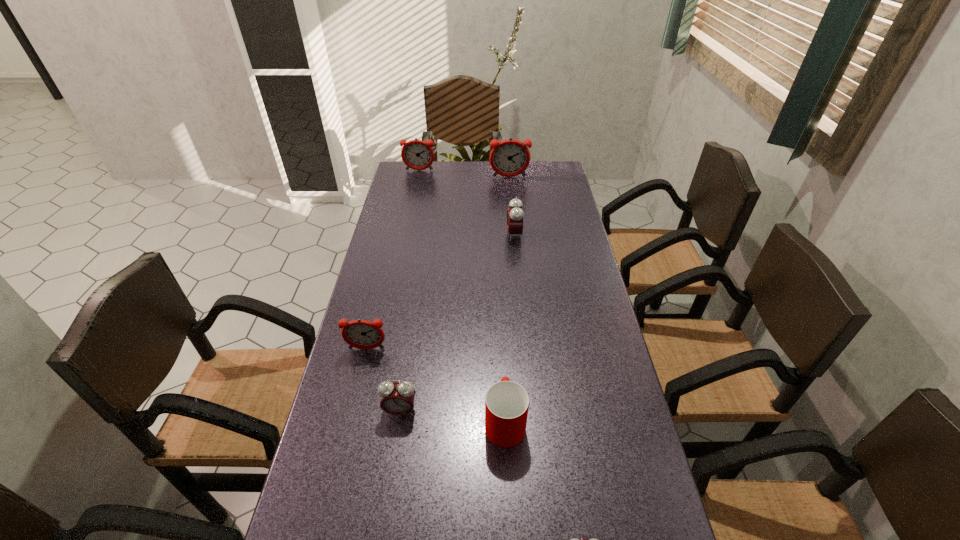
Where is `vacant area between the sixth nearest object and the cup`? vacant area between the sixth nearest object and the cup is located at coordinates (507, 299).

In order to click on free point between the fifth farthest alarm clock and the sixth nearest object in this screenshot , I will do `click(455, 294)`.

Where is `vacant area between the nearest reddish-pink alarm clock and the cup`? The image size is (960, 540). vacant area between the nearest reddish-pink alarm clock and the cup is located at coordinates (436, 385).

What are the coordinates of `vacant space in between the farthest object and the leftmost pink alarm clock` in the screenshot? It's located at (410, 291).

Image resolution: width=960 pixels, height=540 pixels. I want to click on vacant space that is in between the fourth nearest object and the tallest object, so click(x=438, y=263).

This screenshot has width=960, height=540. Identify the location of object that can be found as the second closest to the leftmost pink alarm clock. (506, 403).

Identify which object is located as the third nearest to the second nearest alarm clock. Please provide its 2D coordinates. Your answer should be formatted as a tuple, i.e. [(x, y)], where the tuple contains the x and y coordinates of a point satisfying the conditions above.

[(574, 539)]

Select which alarm clock appears as the closest to the fifth nearest alarm clock. Please provide its 2D coordinates. Your answer should be formatted as a tuple, i.e. [(x, y)], where the tuple contains the x and y coordinates of a point satisfying the conditions above.

[(418, 155)]

Identify which alarm clock is the second closest to the nearest reddish-pink alarm clock. Please provide its 2D coordinates. Your answer should be formatted as a tuple, i.e. [(x, y)], where the tuple contains the x and y coordinates of a point satisfying the conditions above.

[(515, 215)]

Locate an element on the screen. This screenshot has height=540, width=960. reddish-pink alarm clock that can be found as the third closest to the second farthest pink alarm clock is located at coordinates (418, 155).